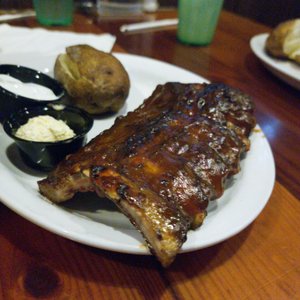
Where is `small black dish`? The image size is (300, 300). small black dish is located at coordinates (8, 103), (43, 157).